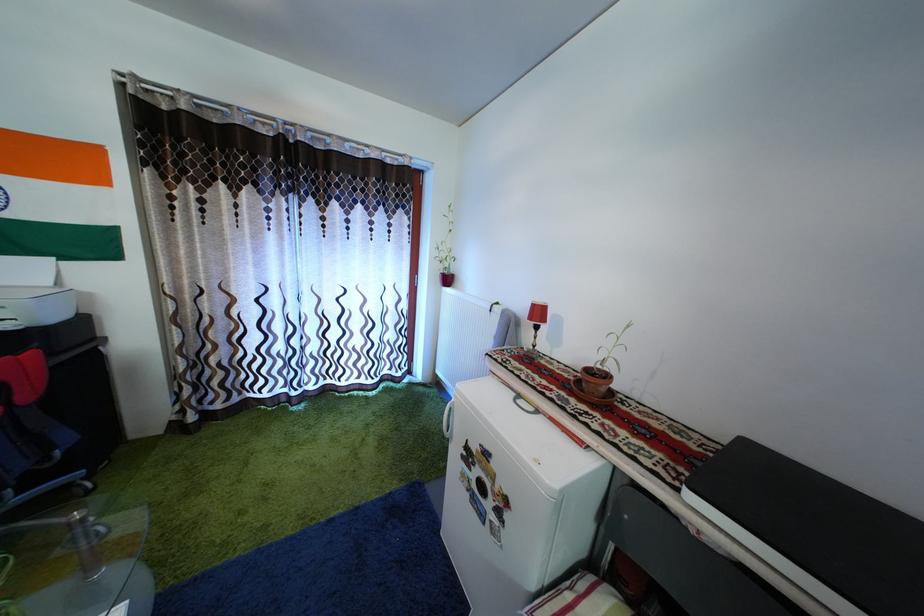
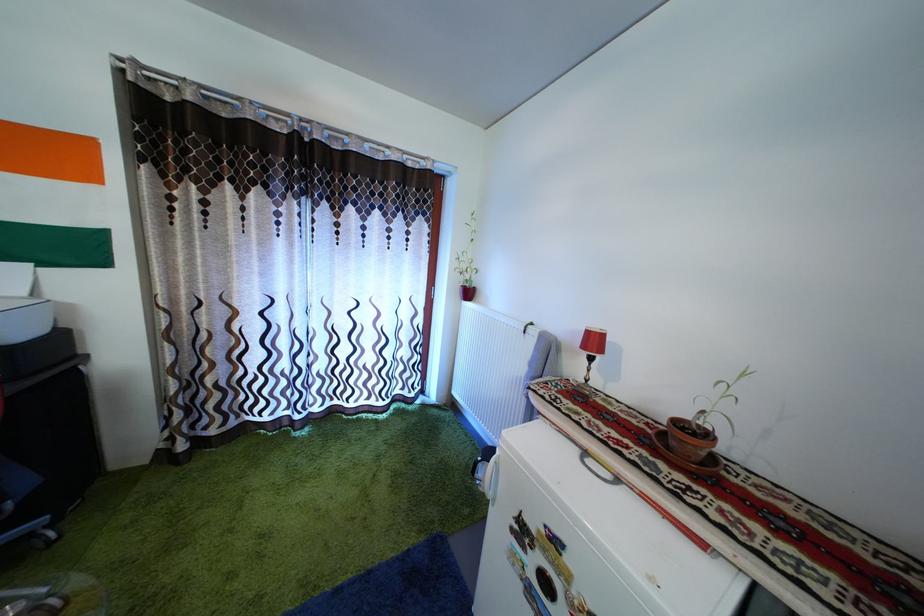
Which direction would the cameraman need to move to produce the second image?

The cameraman moved toward left, forward.